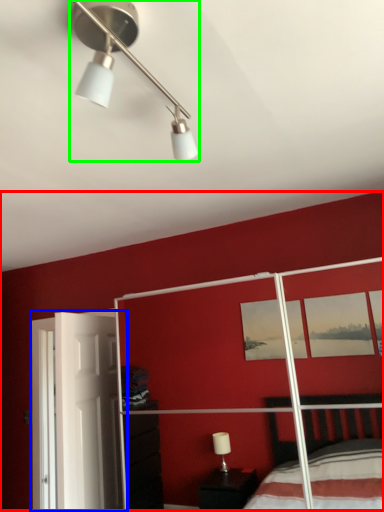
Question: Which is nearer to the backdrop (highlighted by a red box)? screen door (highlighted by a blue box) or lamp (highlighted by a green box).

Choices:
 (A) screen door
 (B) lamp

Answer: (A)